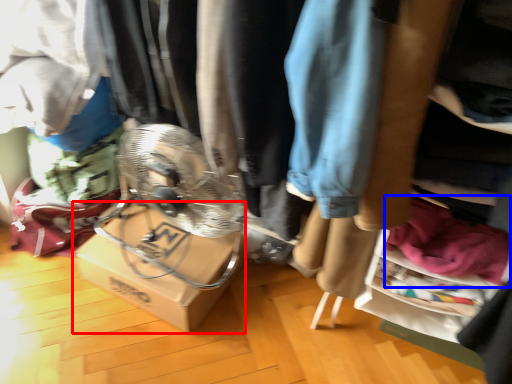
Question: Which object is closer to the camera taking this photo, cardboard box (highlighted by a red box) or clothing (highlighted by a blue box)?

Choices:
 (A) cardboard box
 (B) clothing

Answer: (B)